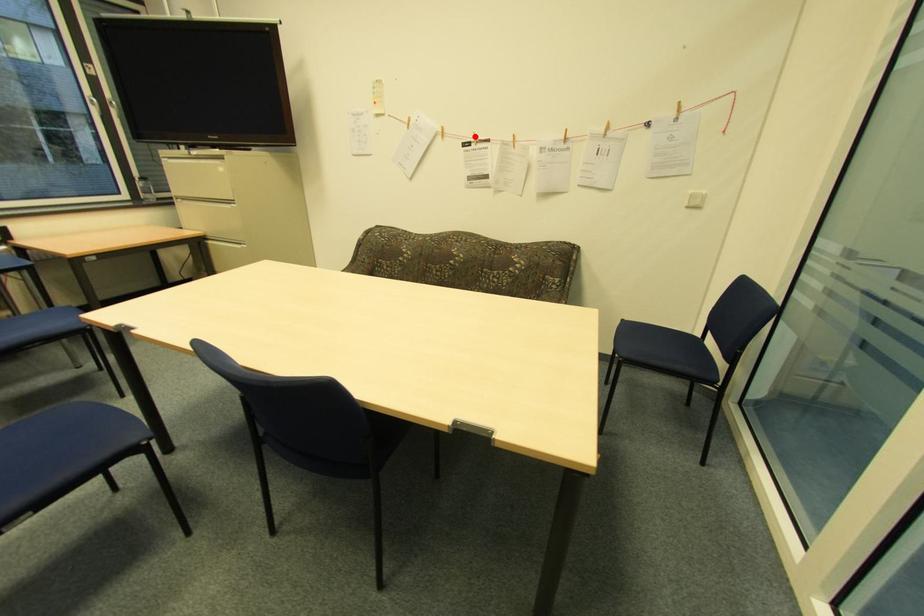
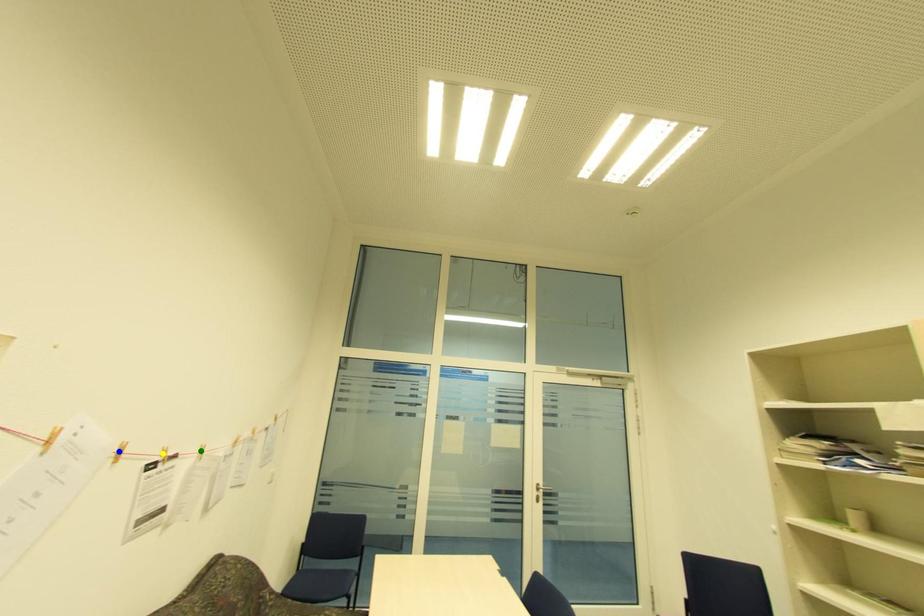
Question: I am providing you with two images of the same scene from different viewpoints. A red point is marked on the first image. You are given multiple points on the second image. Can you choose the point in image 2 that corresponds to the point in image 1?

Choices:
 (A) blue point
 (B) green point
 (C) yellow point

Answer: (C)